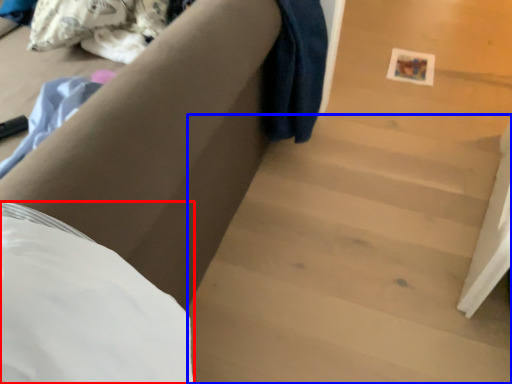
Question: Which point is further to the camera, sheet (highlighted by a red box) or stairwell (highlighted by a blue box)?

Choices:
 (A) sheet
 (B) stairwell

Answer: (B)